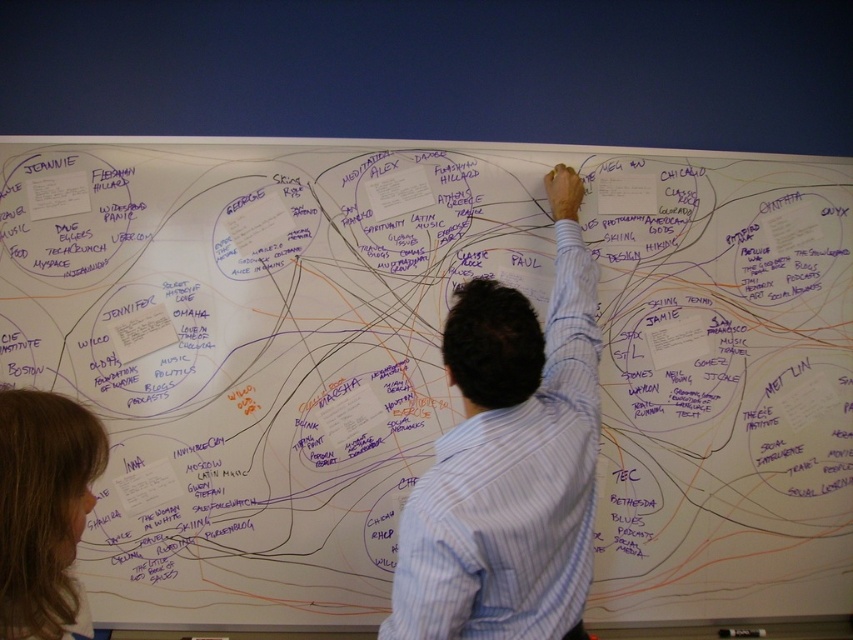
Question: Is white striped shirt at center wider than brown hair at lower left?

Choices:
 (A) no
 (B) yes

Answer: (B)

Question: Is white striped shirt at center thinner than brown hair at lower left?

Choices:
 (A) yes
 (B) no

Answer: (B)

Question: Which point is closer to the camera taking this photo?

Choices:
 (A) (41, 547)
 (B) (546, 330)

Answer: (A)

Question: Is white striped shirt at center to the left of brown hair at lower left from the viewer's perspective?

Choices:
 (A) yes
 (B) no

Answer: (B)

Question: Which object is closer to the camera taking this photo?

Choices:
 (A) brown hair at lower left
 (B) white striped shirt at center

Answer: (A)